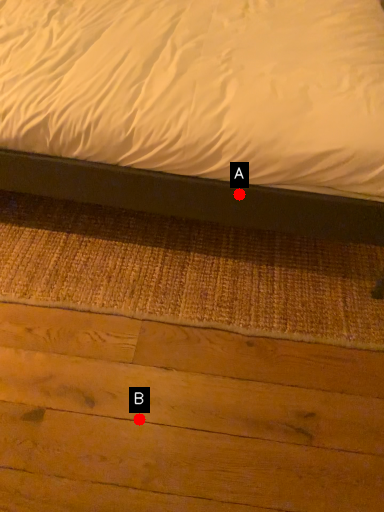
Question: Two points are circled on the image, labeled by A and B beside each circle. Which point is farther from the camera taking this photo?

Choices:
 (A) A is further
 (B) B is further

Answer: (A)